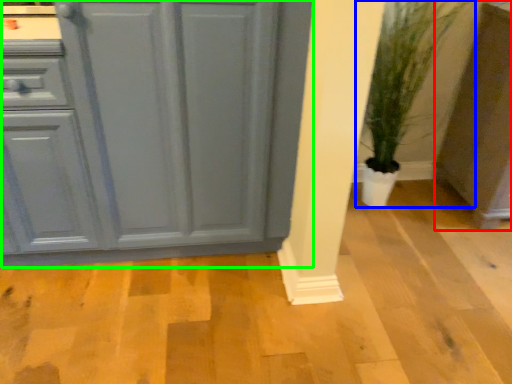
Question: Which is nearer to the cabinetry (highlighted by a red box)? houseplant (highlighted by a blue box) or cabinetry (highlighted by a green box).

Choices:
 (A) houseplant
 (B) cabinetry

Answer: (A)